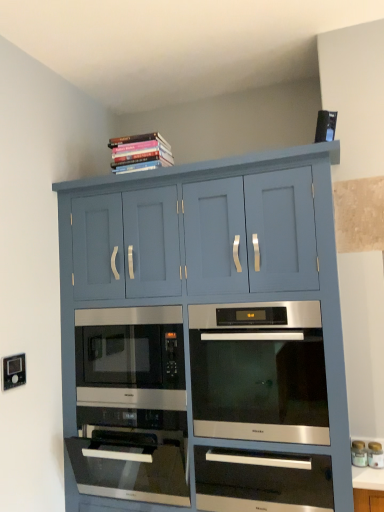
Locate an element on the screen. The image size is (384, 512). free point in front of white glossy jar at lower right, which is the 1th appliance from left to right is located at coordinates (367, 472).